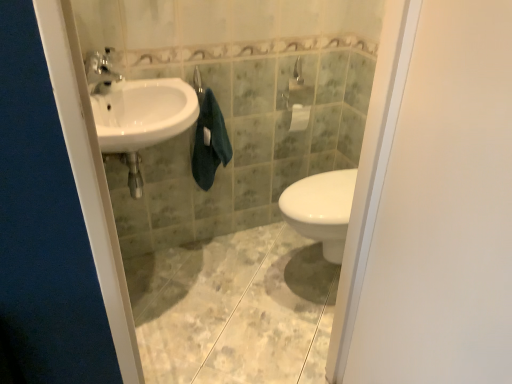
This screenshot has width=512, height=384. What do you see at coordinates (209, 142) in the screenshot?
I see `dark green towel at center` at bounding box center [209, 142].

In order to click on white matte screen door at right in this screenshot , I will do `click(445, 211)`.

Measure the distance between matte silver faucet at upper left and camera.

4.59 feet.

What do you see at coordinates (135, 112) in the screenshot? The width and height of the screenshot is (512, 384). I see `white glossy sink at left` at bounding box center [135, 112].

The height and width of the screenshot is (384, 512). I want to click on dark green towel at center, so tap(209, 142).

This screenshot has width=512, height=384. Identify the location of tap above the white glossy sink at left (from a real-world perspective). (103, 71).

Is matte silver faucet at upper left taller or shorter than white glossy sink at left?

matte silver faucet at upper left is shorter than white glossy sink at left.

How different are the orientations of matte silver faucet at upper left and white glossy sink at left in degrees?

They differ by 2.8 degrees in their facing directions.

From the picture: Is matte silver faucet at upper left positioned beyond the bounds of white glossy sink at left?

Indeed, matte silver faucet at upper left is completely outside white glossy sink at left.

Can you confirm if white matte screen door at right is positioned to the left of white glossy sink at left?

In fact, white matte screen door at right is to the right of white glossy sink at left.

Considering the relative sizes of white matte screen door at right and white glossy sink at left in the image provided, is white matte screen door at right wider than white glossy sink at left?

Incorrect, the width of white matte screen door at right does not surpass that of white glossy sink at left.

Is white matte screen door at right with white glossy sink at left?

white matte screen door at right and white glossy sink at left are clearly separated.

From the image's perspective, is white matte screen door at right over white glossy sink at left?

Incorrect, from the image's perspective, white matte screen door at right is lower than white glossy sink at left.

Is white glossy sink at left at the right side of matte silver faucet at upper left?

Correct, you'll find white glossy sink at left to the right of matte silver faucet at upper left.

Is matte silver faucet at upper left completely or partially inside white glossy sink at left?

No.

Considering the relative sizes of white glossy sink at left and matte silver faucet at upper left in the image provided, is white glossy sink at left taller than matte silver faucet at upper left?

Indeed, white glossy sink at left has a greater height compared to matte silver faucet at upper left.

Is white glossy sink at left smaller than matte silver faucet at upper left?

No.

From the image's perspective, would you say dark green towel at center is positioned over white glossy sink at left?

No, from the image's perspective, dark green towel at center is not on top of white glossy sink at left.

Is dark green towel at center wider than white glossy sink at left?

No, dark green towel at center is not wider than white glossy sink at left.

Between dark green towel at center and white glossy sink at left, which one has smaller size?

With smaller size is dark green towel at center.

From a real-world perspective, is white matte screen door at right physically above dark green towel at center?

Yes, from a real-world perspective, white matte screen door at right is above dark green towel at center.

Who is shorter, white matte screen door at right or dark green towel at center?

dark green towel at center.

Can you confirm if white matte screen door at right is smaller than dark green towel at center?

No.

Is white matte screen door at right spatially inside dark green towel at center, or outside of it?

white matte screen door at right is spatially situated outside dark green towel at center.

Does matte silver faucet at upper left turn towards dark green towel at center?

No, matte silver faucet at upper left is not aimed at dark green towel at center.

Can you confirm if matte silver faucet at upper left is taller than dark green towel at center?

In fact, matte silver faucet at upper left may be shorter than dark green towel at center.

Can we say matte silver faucet at upper left lies outside dark green towel at center?

Yes, matte silver faucet at upper left is outside of dark green towel at center.

The width and height of the screenshot is (512, 384). I want to click on tap above the white matte screen door at right (from the image's perspective), so 103,71.

Is matte silver faucet at upper left bigger or smaller than white matte screen door at right?

matte silver faucet at upper left is smaller than white matte screen door at right.

Considering the sizes of matte silver faucet at upper left and white matte screen door at right in the image, is matte silver faucet at upper left taller or shorter than white matte screen door at right?

In the image, matte silver faucet at upper left appears to be shorter than white matte screen door at right.

Is matte silver faucet at upper left in front of or behind white matte screen door at right in the image?

In the image, matte silver faucet at upper left appears behind white matte screen door at right.

This screenshot has width=512, height=384. I want to click on tap on the left of white glossy sink at left, so [x=103, y=71].

Image resolution: width=512 pixels, height=384 pixels. In order to click on sink positioned vertically above the white matte screen door at right (from a real-world perspective) in this screenshot , I will do `click(135, 112)`.

Estimate the real-world distances between objects in this image. Which object is closer to dark green towel at center, matte silver faucet at upper left or white matte screen door at right?

matte silver faucet at upper left is closer to dark green towel at center.

Which object lies further to the anchor point white matte screen door at right, dark green towel at center or matte silver faucet at upper left?

matte silver faucet at upper left is positioned further to the anchor white matte screen door at right.

From the image, which object appears to be farther from white matte screen door at right, white glossy sink at left or dark green towel at center?

dark green towel at center lies further to white matte screen door at right than the other object.

Considering their positions, is white glossy sink at left positioned further to matte silver faucet at upper left than dark green towel at center?

dark green towel at center is further to matte silver faucet at upper left.

Estimate the real-world distances between objects in this image. Which object is closer to dark green towel at center, matte silver faucet at upper left or white glossy sink at left?

white glossy sink at left is closer to dark green towel at center.

Estimate the real-world distances between objects in this image. Which object is closer to dark green towel at center, white glossy sink at left or white matte screen door at right?

Based on the image, white glossy sink at left appears to be nearer to dark green towel at center.

When comparing their distances from white matte screen door at right, does white glossy sink at left or matte silver faucet at upper left seem further?

The object further to white matte screen door at right is matte silver faucet at upper left.

Looking at the image, which one is located further to white glossy sink at left, matte silver faucet at upper left or dark green towel at center?

Among the two, dark green towel at center is located further to white glossy sink at left.

The width and height of the screenshot is (512, 384). Identify the location of sink located between white matte screen door at right and matte silver faucet at upper left in the depth direction. (135, 112).

The height and width of the screenshot is (384, 512). Find the location of `tap between white matte screen door at right and dark green towel at center from front to back`. tap between white matte screen door at right and dark green towel at center from front to back is located at coordinates (103, 71).

This screenshot has width=512, height=384. Identify the location of sink between white matte screen door at right and dark green towel at center along the z-axis. [135, 112].

Locate an element on the screen. The image size is (512, 384). tap located between white glossy sink at left and dark green towel at center in the depth direction is located at coordinates (103, 71).